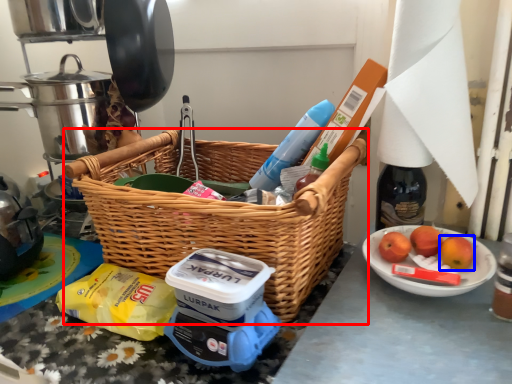
Question: Which object appears farthest to the camera in this image, picnic basket (highlighted by a red box) or apple (highlighted by a blue box)?

Choices:
 (A) picnic basket
 (B) apple

Answer: (B)